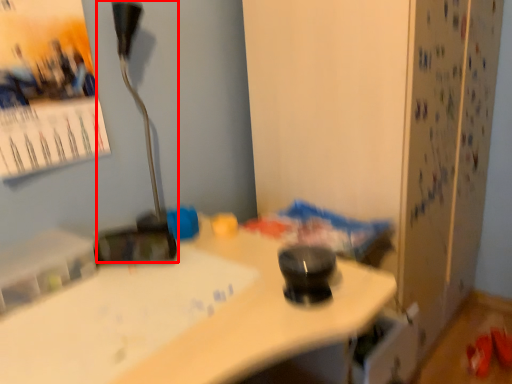
Question: From the image, what is the correct spatial relationship of lamp (annotated by the red box) in relation to poster page?

Choices:
 (A) right
 (B) left

Answer: (A)